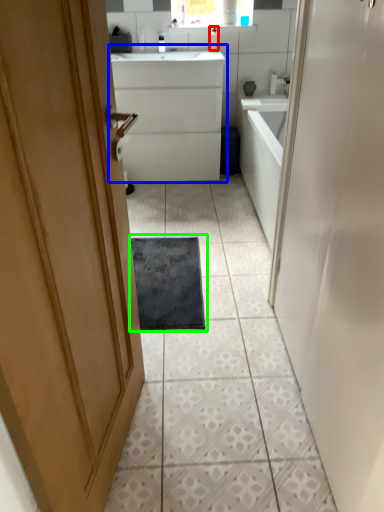
Question: Which object is the farthest from toiletry (highlighted by a red box)? Choose among these: bathroom cabinet (highlighted by a blue box) or bath mat (highlighted by a green box).

Choices:
 (A) bathroom cabinet
 (B) bath mat

Answer: (B)